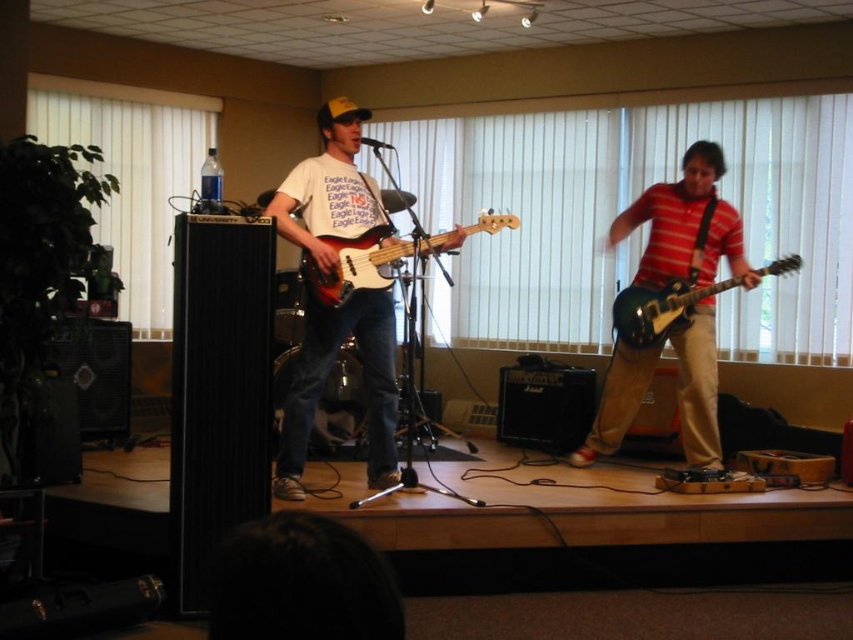
You are a stagehand setting up a new microphone stand. You need to place it between the two points, point (299, 180) and point (373, 244). Which point should the stand be closer to if it needs to be placed behind the performer?

The stand should be closer to point (299, 180) because it is behind point (373, 244), so placing it near the more rear point would position it behind the performer.